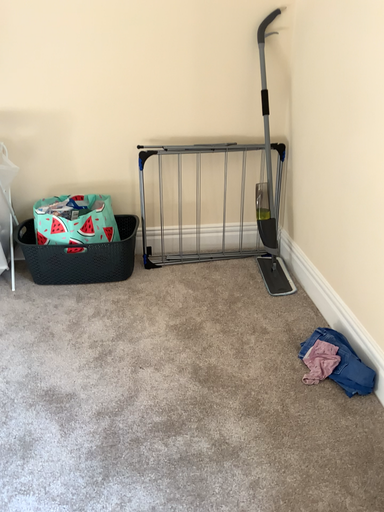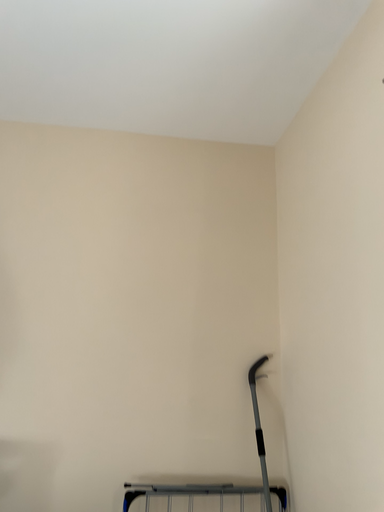
Question: How did the camera likely rotate when shooting the video?

Choices:
 (A) rotated downward
 (B) rotated upward

Answer: (B)